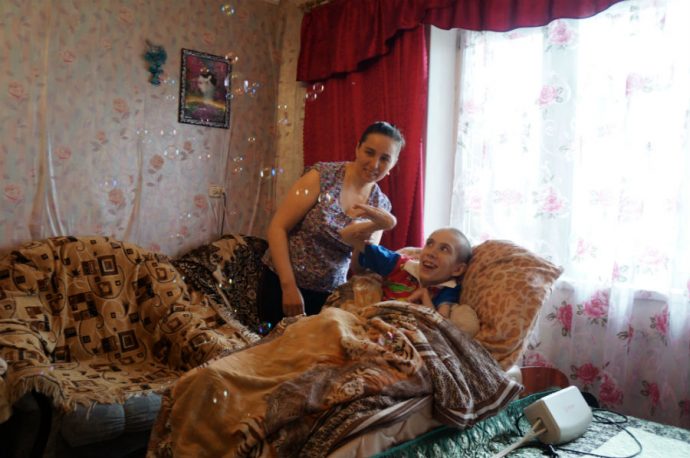
Find the location of a particular element. The width and height of the screenshot is (690, 458). frame is located at coordinates (179, 98).